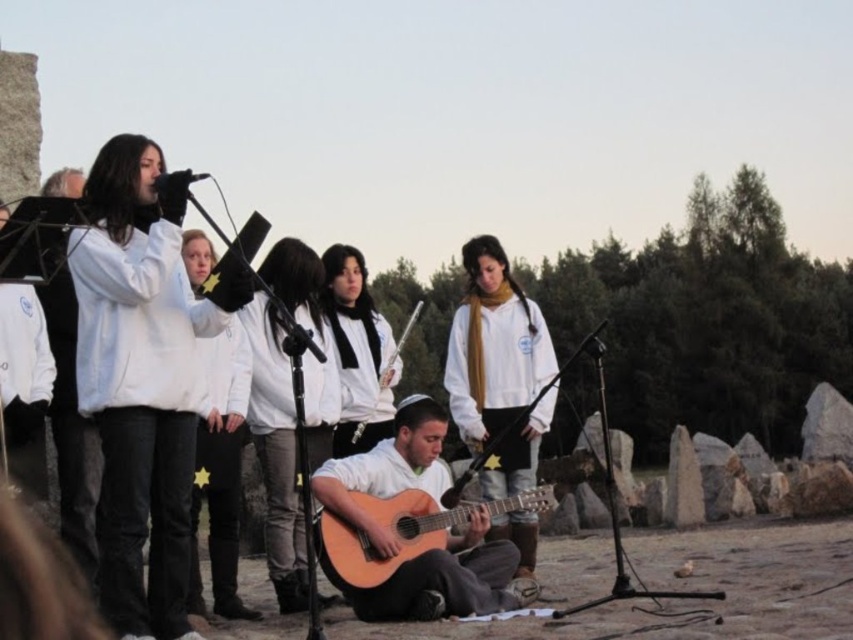
You are a photographer setting up for an outdoor concert. You need to capture a clear shot of the white matte scarf at center and the wooden acoustic guitar at center. Based on their positions, which object should you focus on first to ensure both are in sharp focus?

The white matte scarf at center is in front of the wooden acoustic guitar at center. To ensure both are in sharp focus, you should focus on the white matte scarf at center first since it is closer to the camera.

You are standing at the point marked as point (413, 438) in the image. The distance from you to the nearest microphone stand is 49.87 meters. Is the microphone stand closer to you than 50 meters?

The distance of point (413, 438) from viewer is 49.87 meters, so yes, the microphone stand is closer to you than 50 meters.

You are standing at the point marked by the coordinates point (276,451). Looking around, you see the white matte jacket at center. What is the closest object to your current position?

The closest object to point (276,451) is the white matte jacket at center as it is marked at that coordinate.